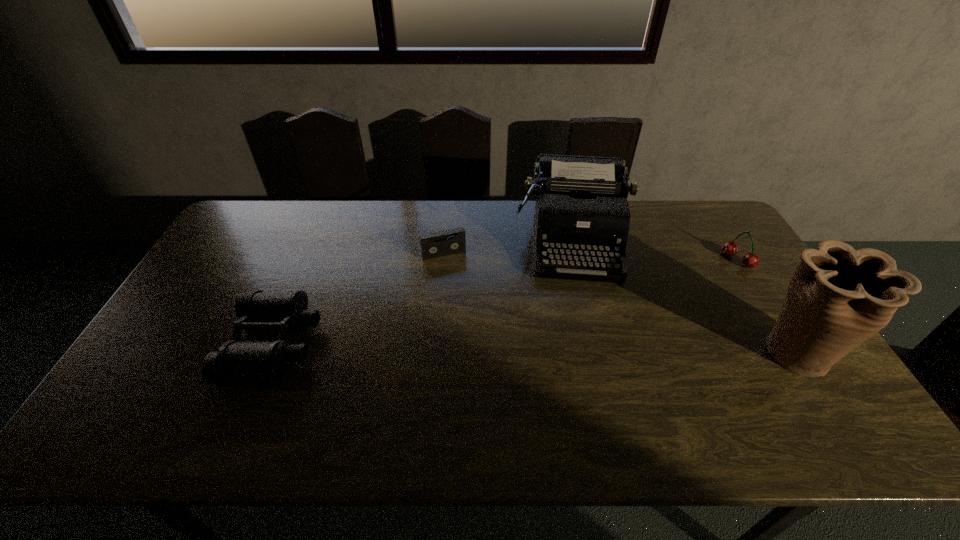
Locate an element on the screen. free space on the desktop that is between the binoculars and the tallest object and is positioned on the front-facing side of the videotape is located at coordinates (479, 348).

This screenshot has height=540, width=960. Find the location of `free space on the desktop that is between the leftmost object and the tallest object and is positioned with stems pointing upwards on the cherry`. free space on the desktop that is between the leftmost object and the tallest object and is positioned with stems pointing upwards on the cherry is located at coordinates (605, 350).

I want to click on vacant spot on the desktop that is between the leftmost object and the urn and is positioned on the typing side of the typewriter, so click(581, 349).